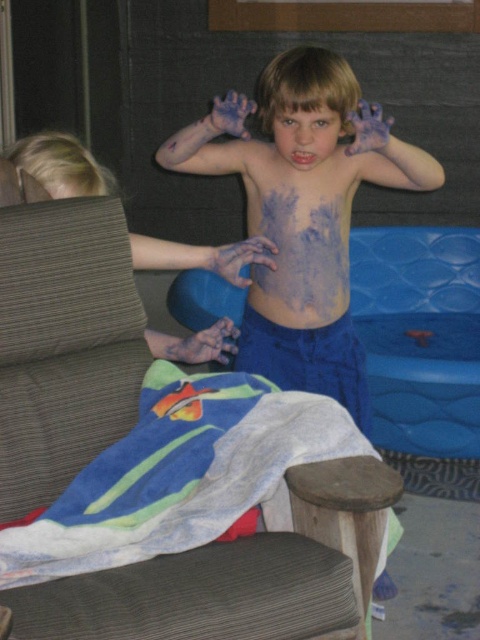
Based on the scene description, can you determine which object is larger between the dark gray fabric armchair at center and the smooth skin face at center?

The dark gray fabric armchair at center is bigger than the smooth skin face at center according to the description.

Based on the scene description, which object is positioned closer to you, the dark gray fabric armchair at center or the smooth skin face at center?

The dark gray fabric armchair at center is closer to the viewer than the smooth skin face at center.